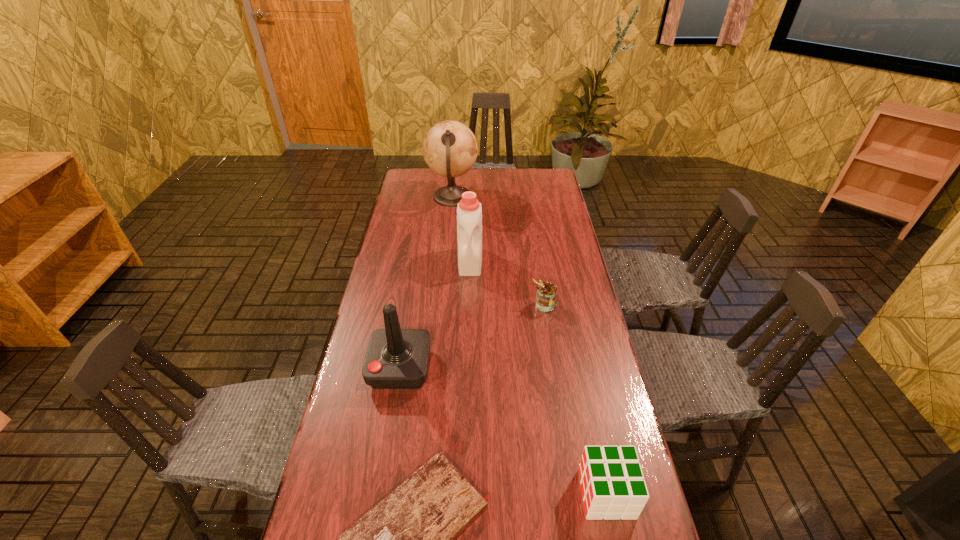
In order to click on vacant space positioned 0.340m on the red face of the cube in this screenshot , I will do `click(434, 494)`.

You are a GUI agent. You are given a task and a screenshot of the screen. Output one action in this format:
    pyautogui.click(x=<x>, y=<y>)
    Task: Click on the free space located 0.220m on the red face of the cube
    The width and height of the screenshot is (960, 540).
    Given the screenshot: What is the action you would take?
    pyautogui.click(x=486, y=494)

The image size is (960, 540). What are the coordinates of `vacant area located on the red face of the cube` in the screenshot? It's located at (429, 494).

The image size is (960, 540). I want to click on object present at the far edge, so click(x=450, y=149).

This screenshot has height=540, width=960. I want to click on globe that is positioned at the left edge, so click(450, 149).

At what (x,y) coordinates should I click in order to perform the action: click on joystick at the left edge. Please return your answer as a coordinate pair (x, y). This screenshot has height=540, width=960. Looking at the image, I should click on (396, 358).

The width and height of the screenshot is (960, 540). What are the coordinates of `can at the right edge` in the screenshot? It's located at (546, 292).

In order to click on cube present at the right edge in this screenshot , I will do `click(612, 482)`.

The image size is (960, 540). Identify the location of object located in the far left corner section of the desktop. (450, 149).

Identify the location of vacant space at the far edge of the desktop. Image resolution: width=960 pixels, height=540 pixels. (486, 183).